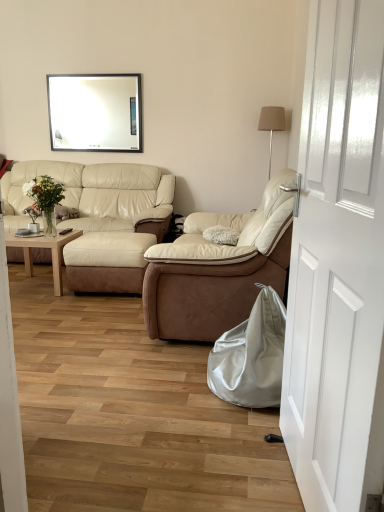
Where is `vacant space in front of satin silver bean bag at lower right`? The image size is (384, 512). vacant space in front of satin silver bean bag at lower right is located at coordinates (223, 438).